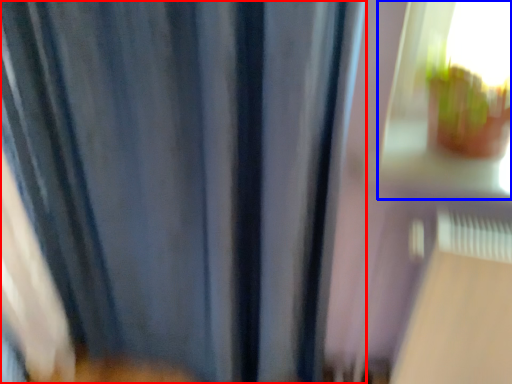
Question: Among these objects, which one is nearest to the camera, curtain (highlighted by a red box) or train window (highlighted by a blue box)?

Choices:
 (A) curtain
 (B) train window

Answer: (A)